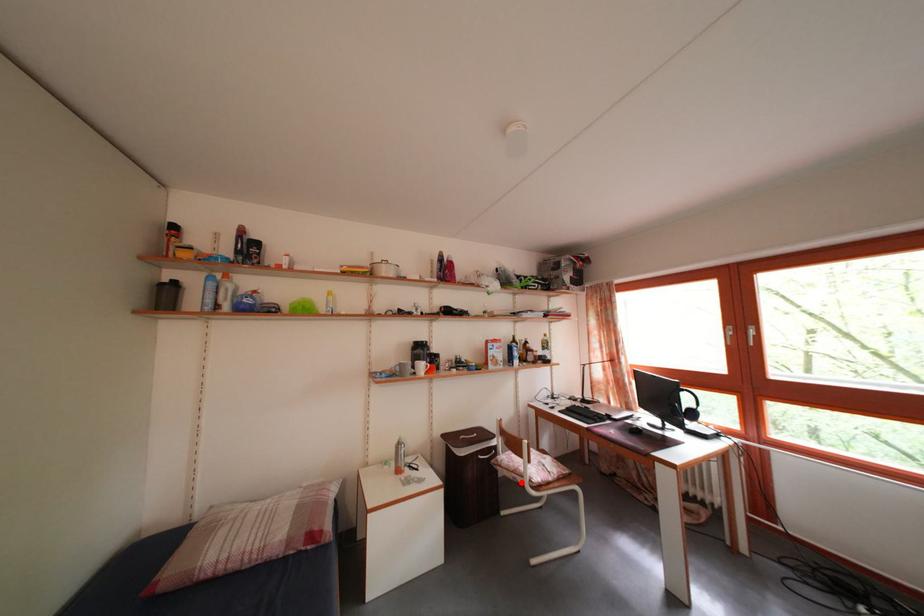
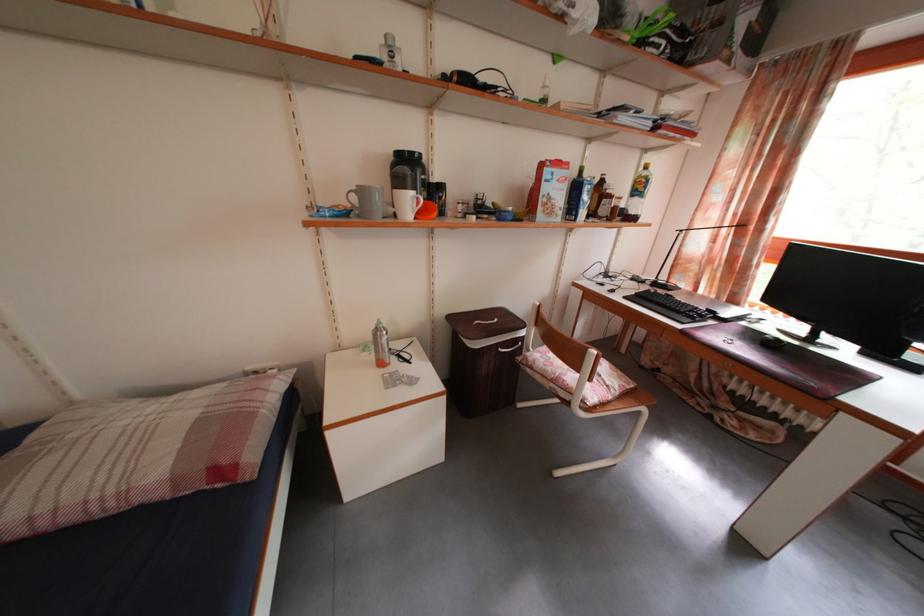
In the second image, find the point that corresponds to the highlighted location in the first image.

(560, 392)